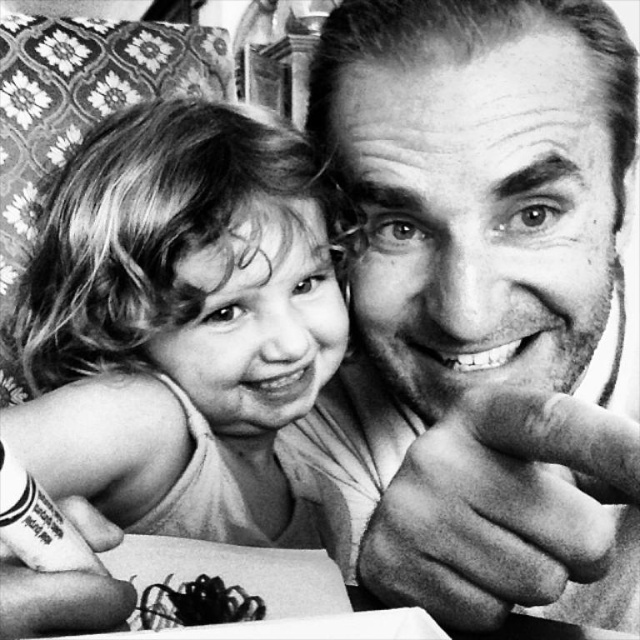
Question: Which object is positioned farthest from the flesh-toned skin at center?

Choices:
 (A) smooth blonde hair at left
 (B) smooth skin face at upper right
 (C) black tattooed hand at lower left

Answer: (A)

Question: Which object is closer to the camera taking this photo?

Choices:
 (A) black tattooed hand at lower left
 (B) smooth blonde hair at left

Answer: (A)

Question: Is smooth skin face at upper right above black tattooed hand at lower left?

Choices:
 (A) no
 (B) yes

Answer: (B)

Question: From the image, what is the correct spatial relationship of smooth skin face at upper right in relation to smooth blonde hair at left?

Choices:
 (A) below
 (B) above

Answer: (B)

Question: Among these objects, which one is farthest from the camera?

Choices:
 (A) smooth skin face at upper right
 (B) smooth blonde hair at left
 (C) flesh-toned skin at center

Answer: (B)

Question: Can you confirm if smooth blonde hair at left is positioned to the left of black tattooed hand at lower left?

Choices:
 (A) no
 (B) yes

Answer: (B)